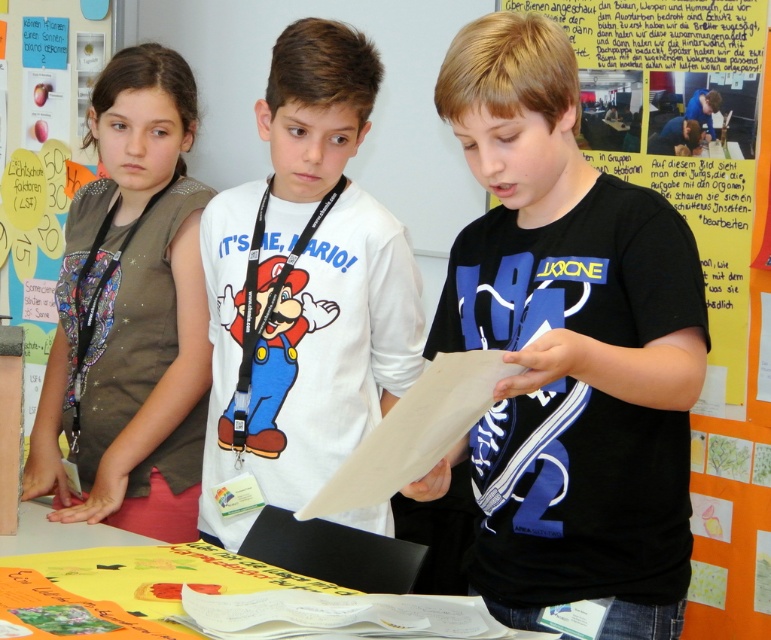
Between white cotton t-shirt at center and matte brown vest at left, which one appears on the right side from the viewer's perspective?

From the viewer's perspective, white cotton t-shirt at center appears more on the right side.

Locate an element on the screen. white cotton t-shirt at center is located at coordinates (305, 291).

Is the position of black matte paper at center less distant than that of multicolored fabric poster at left?

Yes.

Can you confirm if black matte paper at center is smaller than multicolored fabric poster at left?

Actually, black matte paper at center might be larger than multicolored fabric poster at left.

The width and height of the screenshot is (771, 640). In order to click on black matte paper at center in this screenshot , I will do `click(567, 346)`.

You are a GUI agent. You are given a task and a screenshot of the screen. Output one action in this format:
    pyautogui.click(x=<x>, y=<y>)
    Task: Click on the black matte paper at center
    Image resolution: width=771 pixels, height=640 pixels.
    Given the screenshot: What is the action you would take?
    pyautogui.click(x=567, y=346)

Who is taller, multicolored fabric poster at left or yellow paper at lower center?

With more height is multicolored fabric poster at left.

Does multicolored fabric poster at left appear under yellow paper at lower center?

No.

Who is more distant from viewer, (22, 182) or (100, 529)?

The point (22, 182) is more distant.

Locate an element on the screen. The image size is (771, 640). multicolored fabric poster at left is located at coordinates (42, 154).